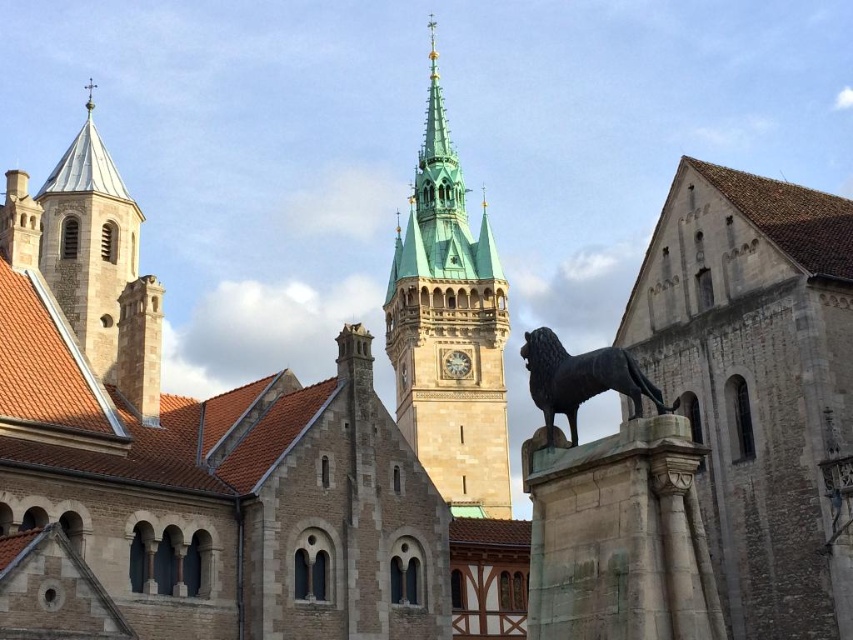
Question: Can you confirm if bronze statue at center is smaller than metallic clock at center?

Choices:
 (A) yes
 (B) no

Answer: (B)

Question: Estimate the real-world distances between objects in this image. Which object is closer to the bronze statue at center?

Choices:
 (A) metallic clock at center
 (B) smooth stone tower at upper left
 (C) green stone clock tower at center

Answer: (B)

Question: Is smooth stone tower at upper left further to the viewer compared to metallic clock at center?

Choices:
 (A) yes
 (B) no

Answer: (B)

Question: Which object is the closest to the bronze statue at center?

Choices:
 (A) smooth stone tower at upper left
 (B) green stone clock tower at center

Answer: (A)

Question: Which object is closer to the camera taking this photo?

Choices:
 (A) smooth stone tower at upper left
 (B) metallic clock at center
 (C) bronze statue at center

Answer: (C)

Question: Does smooth stone tower at upper left have a greater width compared to metallic clock at center?

Choices:
 (A) no
 (B) yes

Answer: (B)